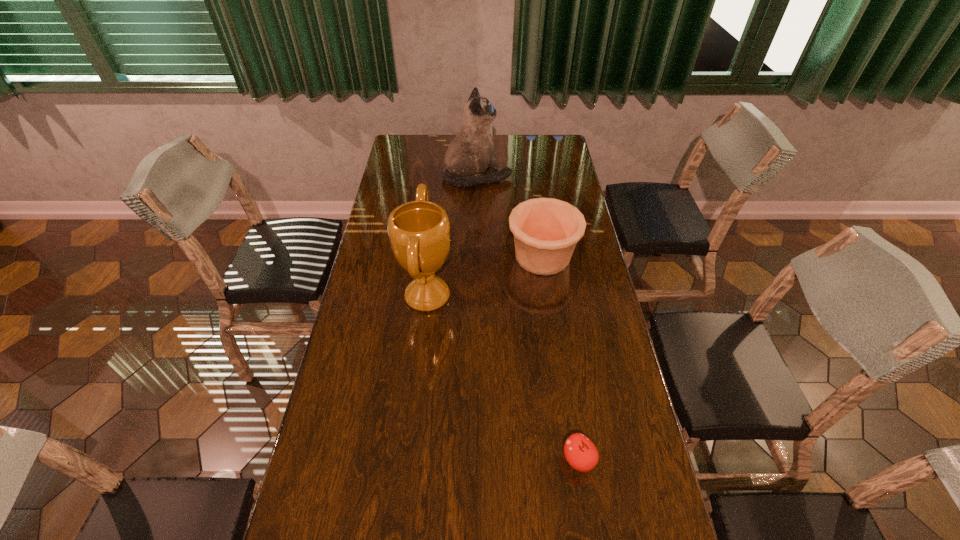
Locate an element on the screen. The width and height of the screenshot is (960, 540). the farthest object is located at coordinates (472, 151).

You are a GUI agent. You are given a task and a screenshot of the screen. Output one action in this format:
    pyautogui.click(x=<x>, y=<y>)
    Task: Click on the award
    
    Given the screenshot: What is the action you would take?
    pyautogui.click(x=419, y=231)

The height and width of the screenshot is (540, 960). I want to click on pottery, so click(546, 230).

Where is `the shortest object`? the shortest object is located at coordinates (580, 452).

Where is `the nearest object`? the nearest object is located at coordinates (580, 452).

Where is `vacant area located at the face of the farthest object`? Image resolution: width=960 pixels, height=540 pixels. vacant area located at the face of the farthest object is located at coordinates (569, 177).

Where is `vacant space located on the front of the award with the decoration`? The image size is (960, 540). vacant space located on the front of the award with the decoration is located at coordinates (537, 296).

The width and height of the screenshot is (960, 540). Find the location of `free space located 0.100m on the left of the second shortest object`. free space located 0.100m on the left of the second shortest object is located at coordinates (479, 256).

Where is `free location located on the right of the apple`? The width and height of the screenshot is (960, 540). free location located on the right of the apple is located at coordinates (628, 459).

At what (x,y) coordinates should I click in order to perform the action: click on object positioned at the left edge. Please return your answer as a coordinate pair (x, y). The height and width of the screenshot is (540, 960). Looking at the image, I should click on (419, 231).